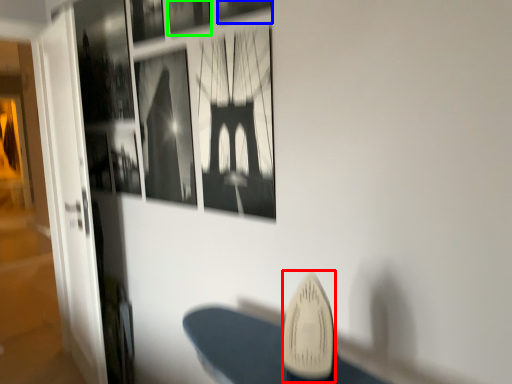
Question: Estimate the real-world distances between objects in this image. Which object is farther from surfboard (highlighted by a red box), picture frame (highlighted by a blue box) or picture frame (highlighted by a green box)?

Choices:
 (A) picture frame
 (B) picture frame

Answer: (B)